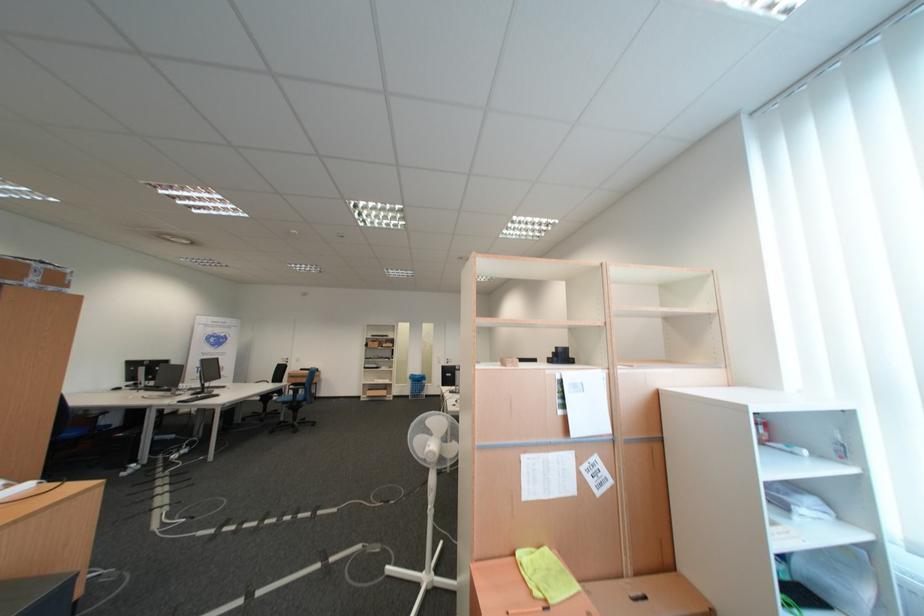
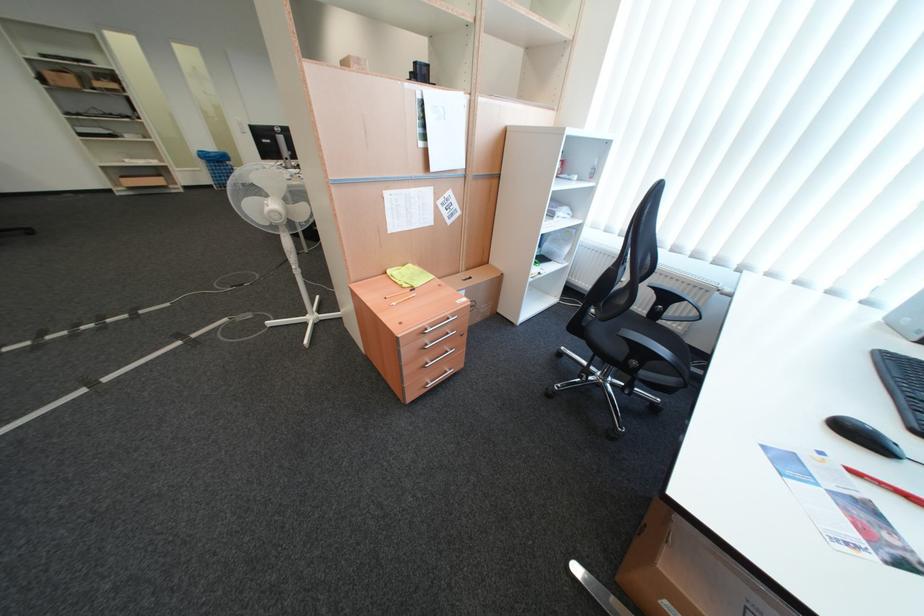
Where in the second image is the point corresponding to pixel 428 385 from the first image?

(227, 168)